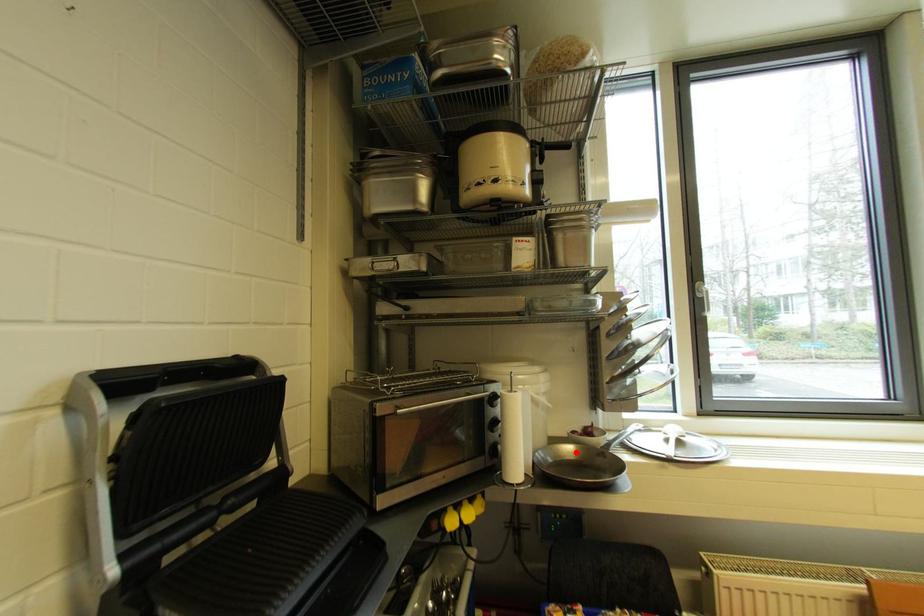
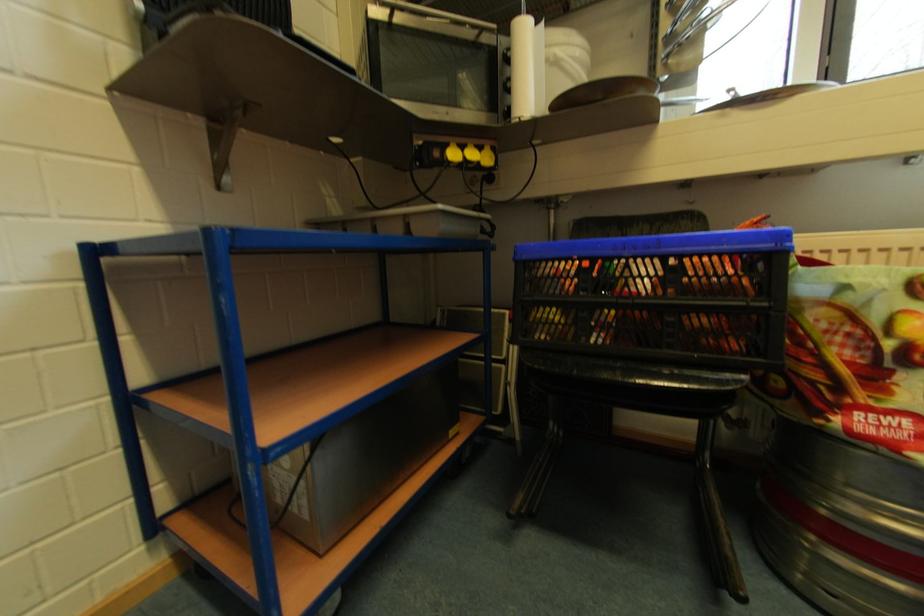
Question: I am providing you with two images of the same scene from different viewpoints. A red point is marked on the first image. Is the red point's position out of view in image 2?

Choices:
 (A) Yes
 (B) No

Answer: (A)